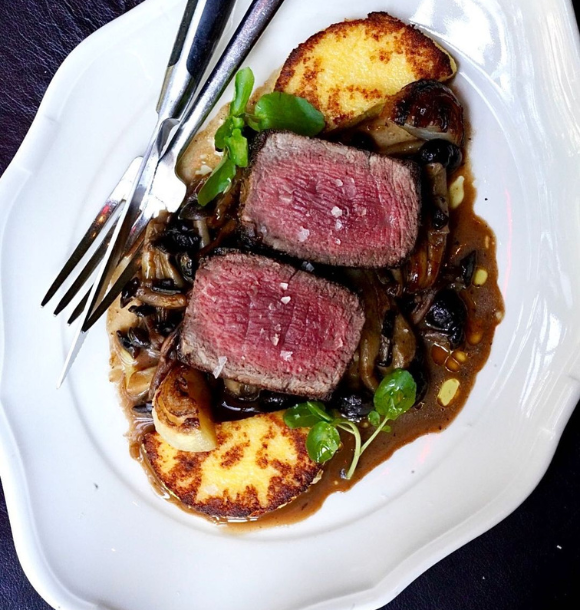
Where is `handle`? Image resolution: width=580 pixels, height=610 pixels. handle is located at coordinates (191, 36), (242, 43).